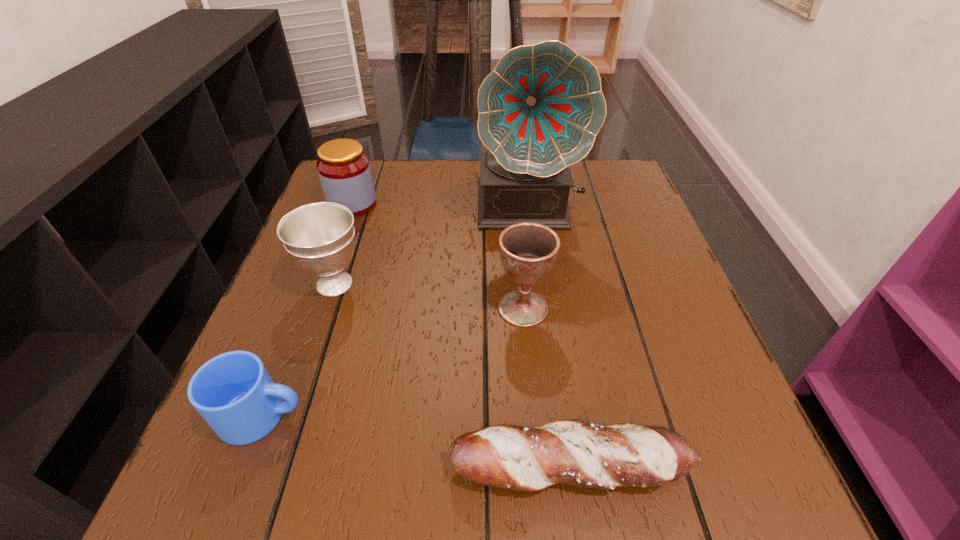
Find the location of a particular element. Image resolution: width=960 pixels, height=540 pixels. the tallest object is located at coordinates (539, 111).

Where is `the right chalice`? Image resolution: width=960 pixels, height=540 pixels. the right chalice is located at coordinates (528, 251).

This screenshot has height=540, width=960. Find the location of `the left chalice`. the left chalice is located at coordinates (319, 237).

I want to click on jar, so click(x=344, y=170).

Locate an element on the screen. Image resolution: width=960 pixels, height=540 pixels. mug is located at coordinates (233, 392).

At what (x,y) coordinates should I click in order to perform the action: click on baguet. Please return your answer as a coordinate pair (x, y). Looking at the image, I should click on (573, 452).

The width and height of the screenshot is (960, 540). Find the location of `free space located 0.090m on the horn of the record player`. free space located 0.090m on the horn of the record player is located at coordinates (537, 266).

This screenshot has width=960, height=540. What are the coordinates of `vacant space located on the left of the right chalice` in the screenshot? It's located at (465, 308).

Find the location of a particular element. The image size is (960, 540). vacant space located on the front of the left chalice is located at coordinates (257, 514).

You are a GUI agent. You are given a task and a screenshot of the screen. Output one action in this format:
    pyautogui.click(x=<x>, y=<y>)
    Task: Click on the free region located on the right of the jar
    This screenshot has height=540, width=960.
    Given the screenshot: What is the action you would take?
    pyautogui.click(x=442, y=204)